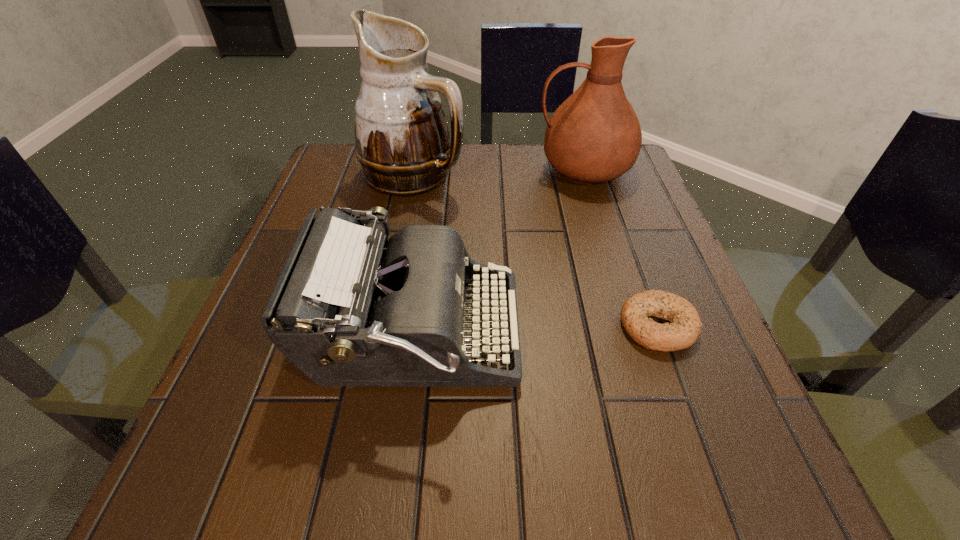
Where is `the left pitcher`? This screenshot has height=540, width=960. the left pitcher is located at coordinates (402, 141).

Locate an element on the screen. The width and height of the screenshot is (960, 540). the right pitcher is located at coordinates (594, 136).

Where is `the second shortest object`? The image size is (960, 540). the second shortest object is located at coordinates pyautogui.click(x=346, y=312).

Where is `the shortest object`? the shortest object is located at coordinates (684, 329).

Find the location of a particular element. Image resolution: width=960 pixels, height=540 pixels. free space located from the spout of the left pitcher is located at coordinates (601, 174).

Find the location of a particular element. Image resolution: width=960 pixels, height=540 pixels. free location located 0.310m on the side of the right pitcher with the handle is located at coordinates (403, 170).

At what (x,y) coordinates should I click in order to perform the action: click on blank area located 0.330m on the side of the right pitcher with the handle. Please return your answer as a coordinate pair (x, y). Image resolution: width=960 pixels, height=540 pixels. Looking at the image, I should click on (395, 170).

You are a GUI agent. You are given a task and a screenshot of the screen. Output one action in this format:
    pyautogui.click(x=<x>, y=<y>)
    Task: Click on the free region located 0.230m on the side of the right pitcher with the handle
    The image size is (960, 540).
    Given the screenshot: What is the action you would take?
    pyautogui.click(x=437, y=170)

What are the coordinates of `vacant space located 0.120m on the front-facing side of the typewriter` in the screenshot? It's located at (594, 335).

Identify the location of vacant space located on the back of the shortest object. Image resolution: width=960 pixels, height=540 pixels. (637, 271).